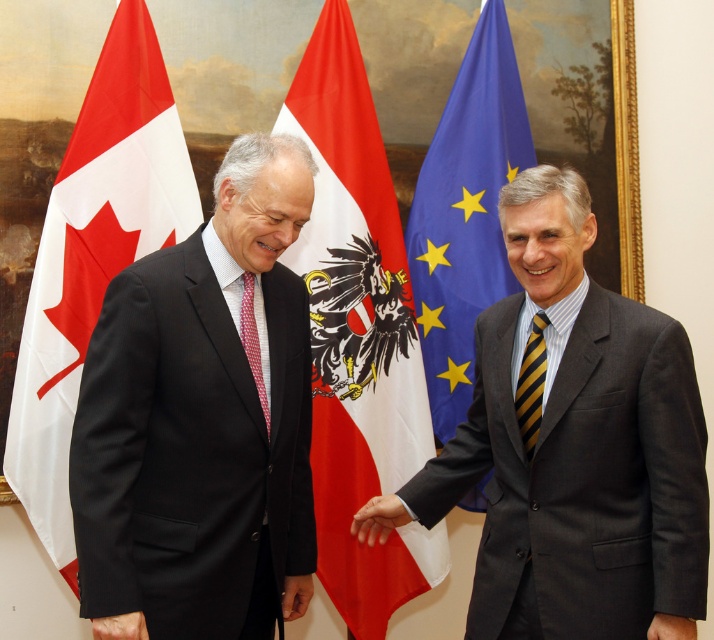
Is yellow striped tie at right to the right of smooth black suit at center from the viewer's perspective?

Incorrect, yellow striped tie at right is not on the right side of smooth black suit at center.

Is yellow striped tie at right above smooth black suit at center?

Yes.

Does point (531, 435) come behind point (668, 621)?

That is True.

Locate an element on the screen. yellow striped tie at right is located at coordinates (531, 385).

Can you confirm if red/white fabric flag at center is wider than smooth skin hand at center?

Yes.

Does red/white fabric flag at center appear on the left side of smooth skin hand at center?

Yes, red/white fabric flag at center is to the left of smooth skin hand at center.

The width and height of the screenshot is (714, 640). Describe the element at coordinates (358, 336) in the screenshot. I see `red/white fabric flag at center` at that location.

Where is `red/white fabric flag at center`? The height and width of the screenshot is (640, 714). red/white fabric flag at center is located at coordinates (358, 336).

Can you confirm if blue fabric flag at right is shorter than smooth black suit at center?

Incorrect, blue fabric flag at right's height does not fall short of smooth black suit at center's.

Between blue fabric flag at right and smooth black suit at center, which one has more height?

blue fabric flag at right is taller.

Identify the location of blue fabric flag at right. (466, 212).

Identify the location of blue fabric flag at right. (466, 212).